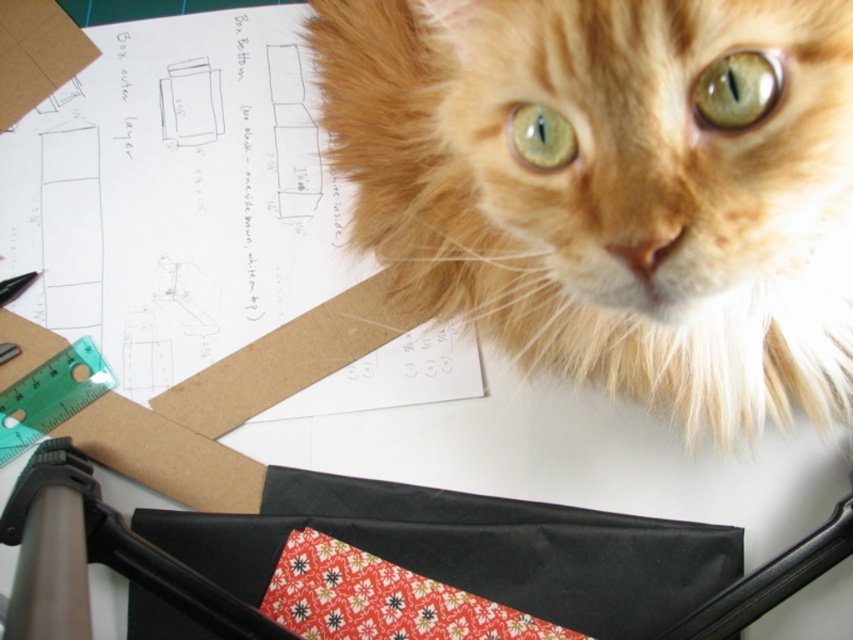
Looking at this image, you are a photographer trying to capture the orange fur cat at upper center in the center of your photo. Given its current position at point coordinates, can you determine if it is already centered?

The orange fur cat at upper center is located at point coordinates, so it is not centered in the photo.

You are an architect designing a new cat tower. You need to place a platform at the point marked by point (x=613, y=186). Based on the scene, where should this platform be placed relative to the orange fur cat at upper center?

The platform should be placed exactly where the orange fur cat at upper center is located since point (x=613, y=186) marks the location of the orange fur cat at upper center.

Consider the image. You are an assistant organizing a workspace. You see the orange fur cat at upper center and the brown cardboard paper at upper left. Which object is closer to the bottom edge of the workspace?

The orange fur cat at upper center is positioned under the brown cardboard paper at upper left, meaning the cat is closer to the bottom edge than the cardboard paper.